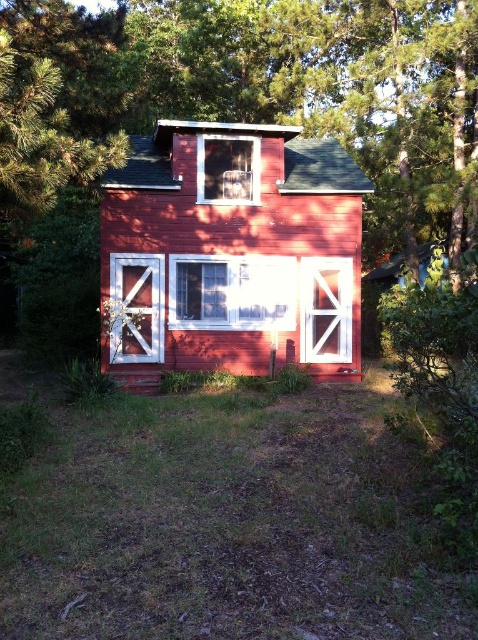
You are a delivery person carrying a package that requires a 3 meter clearance to deliver safely. You need to pass between the smooth red barn at center and the white wood barn door at lower left. Can you safely pass through this space with your package?

The distance between the smooth red barn at center and the white wood barn door at lower left is 2.77 meters, which is less than the required 3 meter clearance. Therefore, you cannot safely pass through this space with your package.